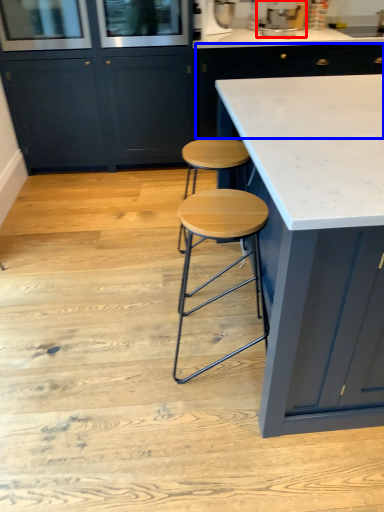
Question: Among these objects, which one is farthest to the camera, appliance (highlighted by a red box) or cabinetry (highlighted by a blue box)?

Choices:
 (A) appliance
 (B) cabinetry

Answer: (B)